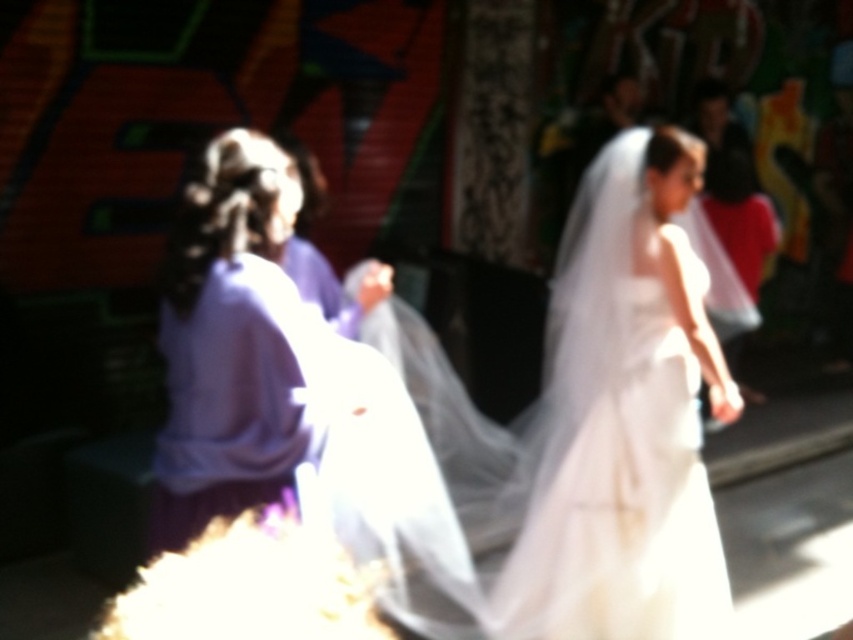
You are a photographer standing at the back of the venue. You want to take a clear photo of the white sheer dress at center. What is the minimum distance you need to maintain to ensure the subject is in focus?

The white sheer dress at center is 6.14 feet away from the viewer. To ensure the subject is in focus, you should maintain a distance of at least 6.14 feet.

You are a photographer at the event and need to adjust the lighting to ensure both the white sheer dress at center and the purple satin dress at left are well illuminated. Given their positions, which dress is positioned lower in the frame?

The white sheer dress at center is positioned lower in the frame than the purple satin dress at left.